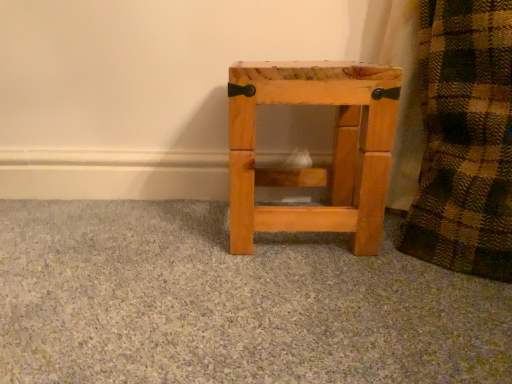
Describe the element at coordinates (332, 154) in the screenshot. I see `natural wood stool at center` at that location.

This screenshot has height=384, width=512. Identify the location of natural wood stool at center. (332, 154).

The width and height of the screenshot is (512, 384). Describe the element at coordinates (230, 303) in the screenshot. I see `natural wood stool at center` at that location.

This screenshot has width=512, height=384. In order to click on natural wood stool at center in this screenshot , I will do `click(230, 303)`.

Locate an element on the screen. This screenshot has height=384, width=512. natural wood stool at center is located at coordinates (332, 154).

Visually, is natural wood stool at center positioned to the left or to the right of natural wood stool at center?

From the image, it's evident that natural wood stool at center is to the left of natural wood stool at center.

In the image, is natural wood stool at center positioned in front of or behind natural wood stool at center?

natural wood stool at center is positioned closer to the viewer than natural wood stool at center.

Considering the positions of point (445, 377) and point (320, 95), is point (445, 377) closer or farther from the camera than point (320, 95)?

Point (445, 377) is positioned closer to the camera compared to point (320, 95).

From the image's perspective, which object appears higher, natural wood stool at center or natural wood stool at center?

natural wood stool at center is shown above in the image.

From a real-world perspective, which object stands above the other?

natural wood stool at center, from a real-world perspective.

Which object is thinner, natural wood stool at center or natural wood stool at center?

natural wood stool at center is thinner.

Is natural wood stool at center shorter than natural wood stool at center?

Correct, natural wood stool at center is not as tall as natural wood stool at center.

In the scene shown: Considering the sizes of objects natural wood stool at center and natural wood stool at center in the image provided, who is bigger, natural wood stool at center or natural wood stool at center?

natural wood stool at center is bigger.

Would you say natural wood stool at center is part of natural wood stool at center's contents?

No, natural wood stool at center does not contain natural wood stool at center.

Are natural wood stool at center and natural wood stool at center far apart?

They are positioned close to each other.

Could you tell me if natural wood stool at center is turned towards natural wood stool at center?

No, natural wood stool at center is not turned towards natural wood stool at center.

Locate an element on the screen. concrete on the left of natural wood stool at center is located at coordinates (230, 303).

Which object is positioned more to the right, natural wood stool at center or natural wood stool at center?

Positioned to the right is natural wood stool at center.

Considering their positions, is natural wood stool at center located in front of or behind natural wood stool at center?

Clearly, natural wood stool at center is behind natural wood stool at center.

Which is closer, (331, 64) or (11, 286)?

Point (11, 286)

From the image's perspective, is natural wood stool at center over natural wood stool at center?

Yes, from the image's perspective, natural wood stool at center is on top of natural wood stool at center.

From a real-world perspective, is natural wood stool at center above or below natural wood stool at center?

natural wood stool at center is above natural wood stool at center.

Does natural wood stool at center have a greater width compared to natural wood stool at center?

No, natural wood stool at center is not wider than natural wood stool at center.

Considering the sizes of objects natural wood stool at center and natural wood stool at center in the image provided, who is taller, natural wood stool at center or natural wood stool at center?

With more height is natural wood stool at center.

Between natural wood stool at center and natural wood stool at center, which one has larger size?

Bigger between the two is natural wood stool at center.

Is natural wood stool at center inside or outside of natural wood stool at center?

natural wood stool at center is not inside natural wood stool at center, it's outside.

Is natural wood stool at center not near natural wood stool at center?

No.

Is natural wood stool at center aimed at natural wood stool at center?

No, natural wood stool at center is not turned towards natural wood stool at center.

How many degrees apart are the facing directions of natural wood stool at center and natural wood stool at center?

2.39 degrees.

Locate an element on the screen. The height and width of the screenshot is (384, 512). concrete that appears on the left of natural wood stool at center is located at coordinates (230, 303).

Locate an element on the screen. concrete on the left of natural wood stool at center is located at coordinates (230, 303).

In order to click on concrete that appears below the natural wood stool at center (from a real-world perspective) in this screenshot , I will do `click(230, 303)`.